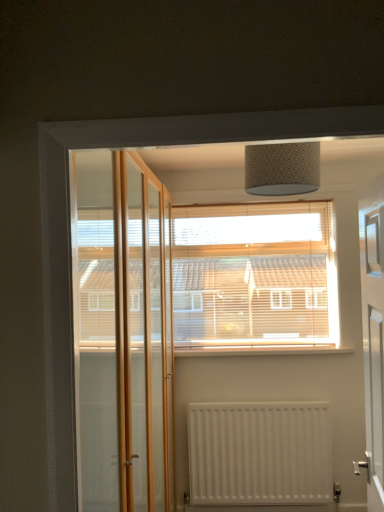
I want to click on free spot above white painted wood at center (from a real-world perspective), so click(259, 346).